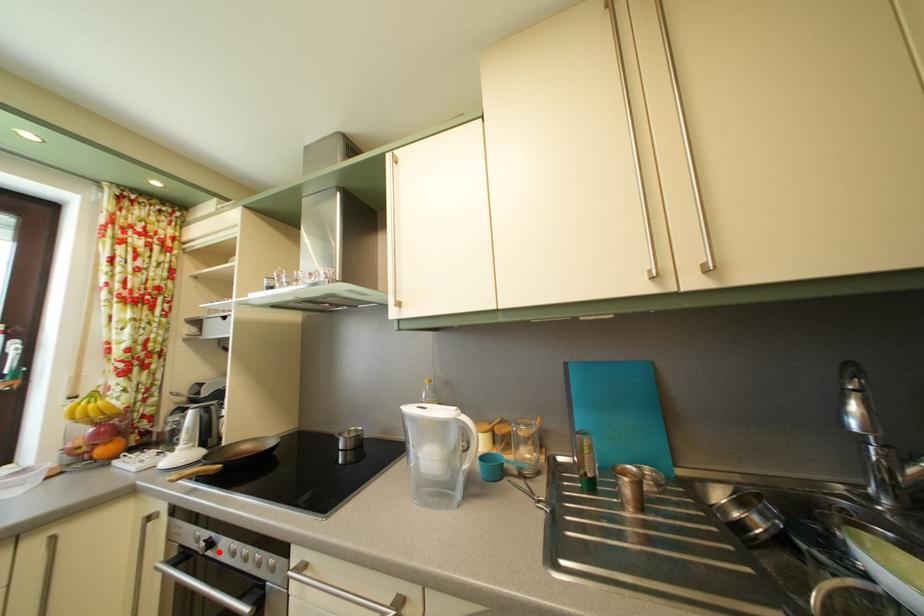
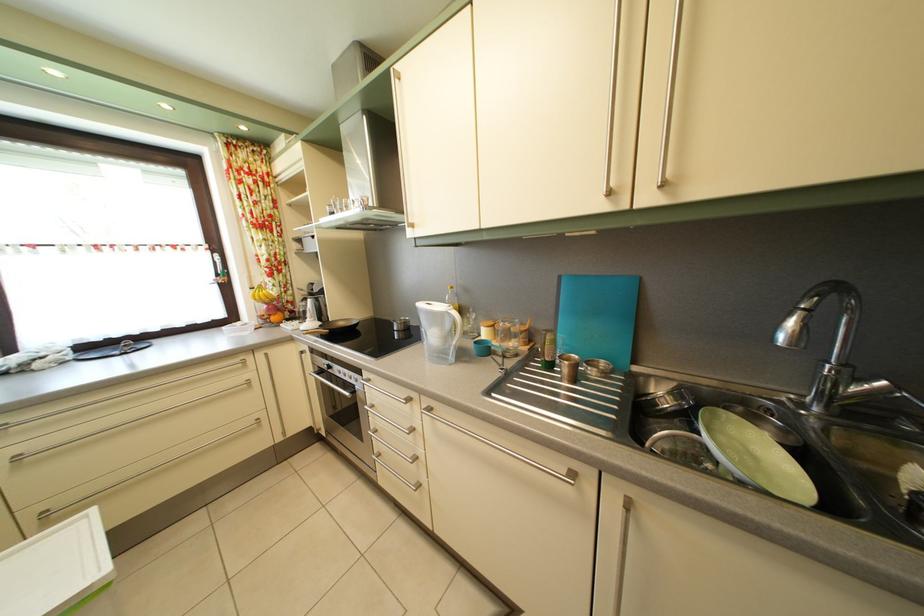
Question: I am providing you with two images of the same scene from different viewpoints. In image1, a red point is highlighted. Considering the same 3D point in image2, which of the following is correct?

Choices:
 (A) It is closer
 (B) It is farther

Answer: (B)